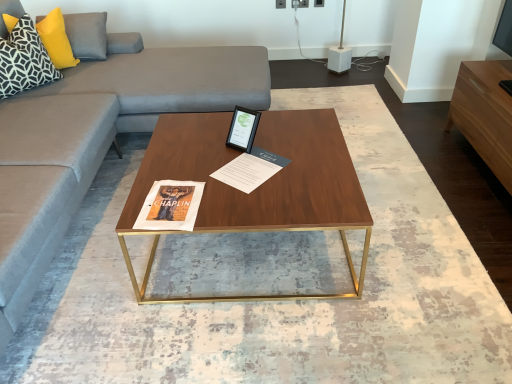
Where is `space that is in front of matte black tablet at center`? space that is in front of matte black tablet at center is located at coordinates (240, 162).